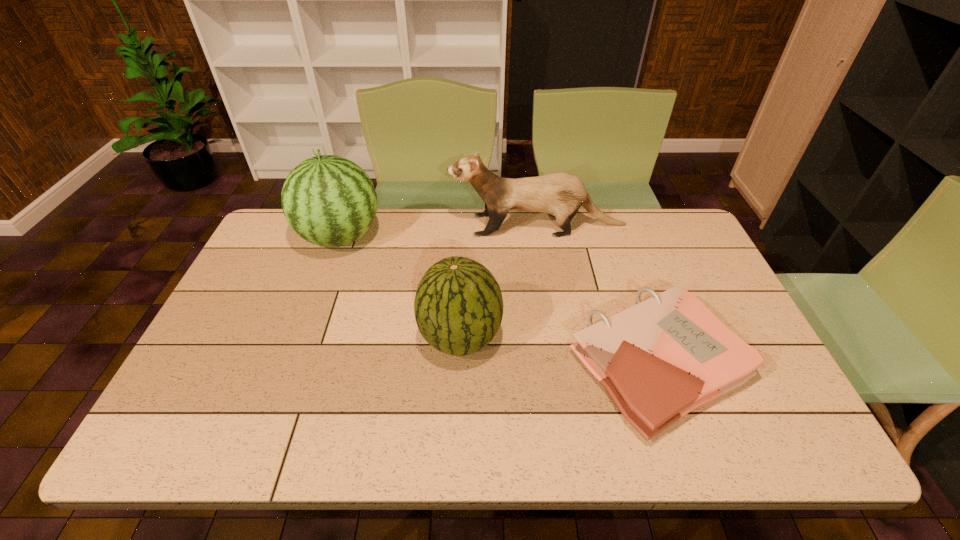
You are a GUI agent. You are given a task and a screenshot of the screen. Output one action in this format:
    pyautogui.click(x=<x>, y=<y>)
    Task: Click on the left watermelon
    The height and width of the screenshot is (540, 960).
    Given the screenshot: What is the action you would take?
    pyautogui.click(x=328, y=200)

This screenshot has width=960, height=540. I want to click on the taller watermelon, so click(328, 200).

Image resolution: width=960 pixels, height=540 pixels. What are the coordinates of `ferret` in the screenshot? It's located at (561, 194).

Identify the location of the shorter watermelon. The height and width of the screenshot is (540, 960). (458, 307).

This screenshot has width=960, height=540. I want to click on the nearer watermelon, so click(458, 307).

Identify the location of the shortest object. (660, 359).

The width and height of the screenshot is (960, 540). What are the coordinates of `vacant space located 0.380m on the right of the farther watermelon` in the screenshot? It's located at (497, 238).

Locate an element on the screen. vacant position located 0.240m on the face of the ferret is located at coordinates (380, 226).

At what (x,y) coordinates should I click in order to perform the action: click on free space located 0.400m on the face of the ferret. Please return your answer as a coordinate pair (x, y). This screenshot has width=960, height=540. Looking at the image, I should click on (333, 226).

The image size is (960, 540). I want to click on blank space located 0.080m on the face of the ferret, so click(426, 226).